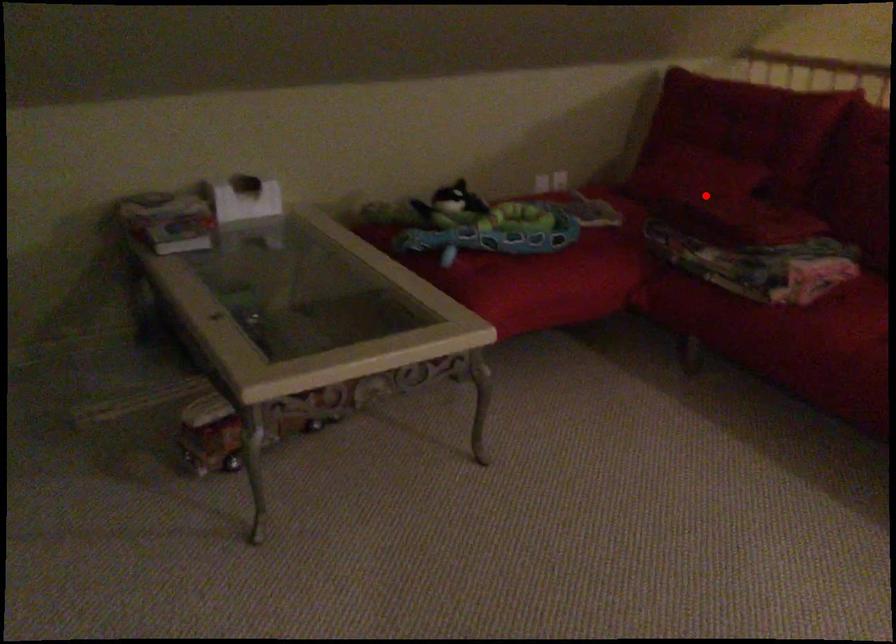
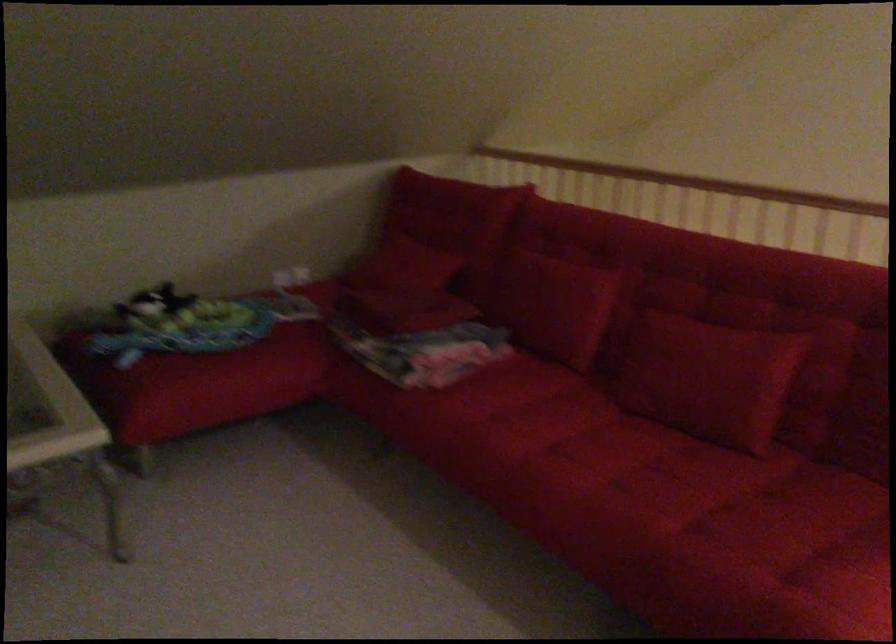
Question: I am providing you with two images of the same scene from different viewpoints. Given a red point in image1, look at the same physical point in image2. Is it:

Choices:
 (A) Closer to the viewpoint
 (B) Farther from the viewpoint

Answer: (B)